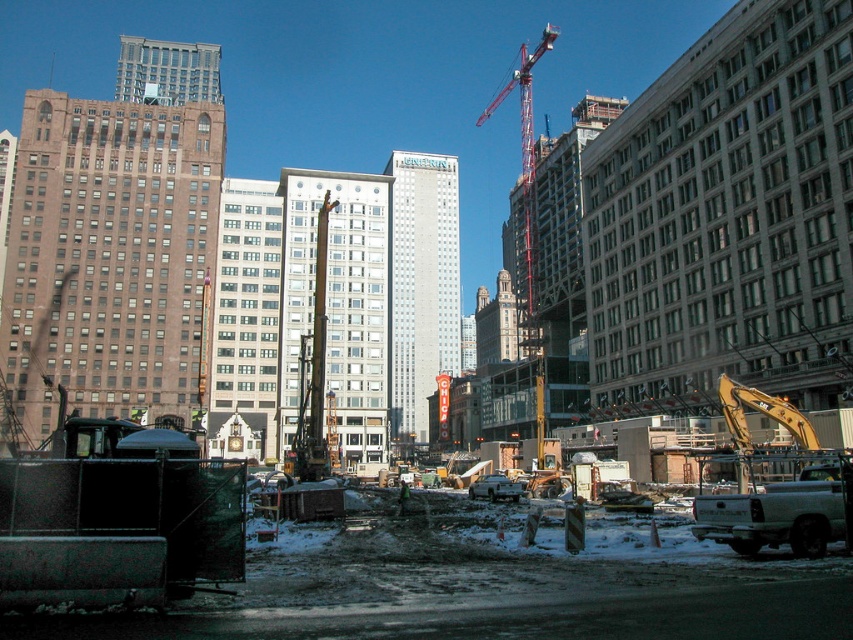
You are a city planner reviewing the construction site layout. You need to ensure that the red metal crane at upper center and the green fabric construction worker at center do not block the view of the historic building located behind them. Given their sizes, which object might pose a greater obstruction to the view?

The red metal crane at upper center has a larger width than the green fabric construction worker at center, so it would likely block more of the view of the historic building behind them.

Consider the image. You are a city planner standing at the construction site and want to assess the visibility of the red metal crane at upper center from your current position. Given that the crane is 476.81 feet away, would it be visible to the naked eye from where you are standing?

The red metal crane at upper center is 476.81 feet away from the viewer. Since this distance is within the typical range of human visual acuity, the crane would likely be visible to the naked eye from your current position at the construction site.